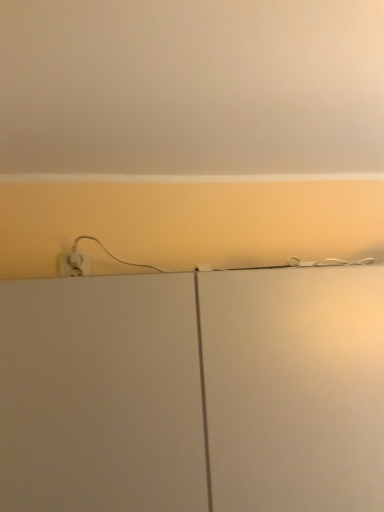
What do you see at coordinates (101, 395) in the screenshot?
I see `white matte cabinet at center` at bounding box center [101, 395].

Image resolution: width=384 pixels, height=512 pixels. What are the coordinates of `white matte cabinet at center` in the screenshot? It's located at point(101,395).

Based on the photo, in order to face matte white wall at upper center, should I rotate leftwards or rightwards?

To face it directly, rotate right by 4.490 degrees.

Describe the element at coordinates (191, 87) in the screenshot. I see `matte white wall at upper center` at that location.

The width and height of the screenshot is (384, 512). Find the location of `matte white wall at upper center`. matte white wall at upper center is located at coordinates (191, 87).

Find the location of a particular element. Image resolution: width=384 pixels, height=512 pixels. white matte cabinet at center is located at coordinates (101, 395).

Visually, is white matte cabinet at center positioned to the left or to the right of matte white wall at upper center?

From the image, it's evident that white matte cabinet at center is to the left of matte white wall at upper center.

Considering their positions, is white matte cabinet at center located in front of or behind matte white wall at upper center?

white matte cabinet at center is behind matte white wall at upper center.

Which is behind, point (377, 347) or point (355, 145)?

The point (355, 145) is behind.

From the image's perspective, between white matte cabinet at center and matte white wall at upper center, who is located below?

white matte cabinet at center appears lower in the image.

In the scene shown: From a real-world perspective, which is physically below, white matte cabinet at center or matte white wall at upper center?

In real-world perspective, white matte cabinet at center is lower.

Considering the relative sizes of white matte cabinet at center and matte white wall at upper center in the image provided, is white matte cabinet at center wider than matte white wall at upper center?

No, white matte cabinet at center is not wider than matte white wall at upper center.

In the scene shown: Who is taller, white matte cabinet at center or matte white wall at upper center?

white matte cabinet at center.

Looking at the image, does white matte cabinet at center seem bigger or smaller compared to matte white wall at upper center?

Considering their sizes, white matte cabinet at center takes up more space than matte white wall at upper center.

Is white matte cabinet at center not within matte white wall at upper center?

Yes, white matte cabinet at center is located beyond the bounds of matte white wall at upper center.

Is white matte cabinet at center far away from matte white wall at upper center?

No, white matte cabinet at center is in close proximity to matte white wall at upper center.

Does white matte cabinet at center turn towards matte white wall at upper center?

No.

Measure the distance between white matte cabinet at center and matte white wall at upper center.

white matte cabinet at center and matte white wall at upper center are 19.52 inches apart from each other.

Locate an element on the screen. The width and height of the screenshot is (384, 512). backdrop in front of the white matte cabinet at center is located at coordinates (191, 87).

Is matte white wall at upper center to the left of white matte cabinet at center from the viewer's perspective?

Incorrect, matte white wall at upper center is not on the left side of white matte cabinet at center.

Which object is further away from the camera, matte white wall at upper center or white matte cabinet at center?

white matte cabinet at center.

Considering the positions of points (138, 90) and (192, 497), is point (138, 90) closer to camera compared to point (192, 497)?

No, (138, 90) is further to viewer.

From the image's perspective, who appears lower, matte white wall at upper center or white matte cabinet at center?

white matte cabinet at center.

From a real-world perspective, which object stands above the other?

From a 3D spatial view, matte white wall at upper center is above.

Does matte white wall at upper center have a greater width compared to white matte cabinet at center?

Yes.

In terms of height, does matte white wall at upper center look taller or shorter compared to white matte cabinet at center?

Considering their sizes, matte white wall at upper center has less height than white matte cabinet at center.

Can you confirm if matte white wall at upper center is smaller than white matte cabinet at center?

Yes.

Which is correct: matte white wall at upper center is inside white matte cabinet at center, or outside of it?

matte white wall at upper center exists outside the volume of white matte cabinet at center.

Is matte white wall at upper center directly adjacent to white matte cabinet at center?

No, matte white wall at upper center is not with white matte cabinet at center.

Is matte white wall at upper center looking in the opposite direction of white matte cabinet at center?

No, matte white wall at upper center's orientation is not away from white matte cabinet at center.

In the scene shown: What's the angular difference between matte white wall at upper center and white matte cabinet at center's facing directions?

matte white wall at upper center and white matte cabinet at center are facing 91.5 degrees away from each other.

How distant is matte white wall at upper center from white matte cabinet at center?

49.59 centimeters.

Find the location of `cabinetry that is under the matte white wall at upper center (from a real-world perspective)`. cabinetry that is under the matte white wall at upper center (from a real-world perspective) is located at coordinates (101, 395).

Locate an element on the screen. cabinetry lying on the left of matte white wall at upper center is located at coordinates click(101, 395).

This screenshot has width=384, height=512. Find the location of `cabinetry directly beneath the matte white wall at upper center (from a real-world perspective)`. cabinetry directly beneath the matte white wall at upper center (from a real-world perspective) is located at coordinates (101, 395).